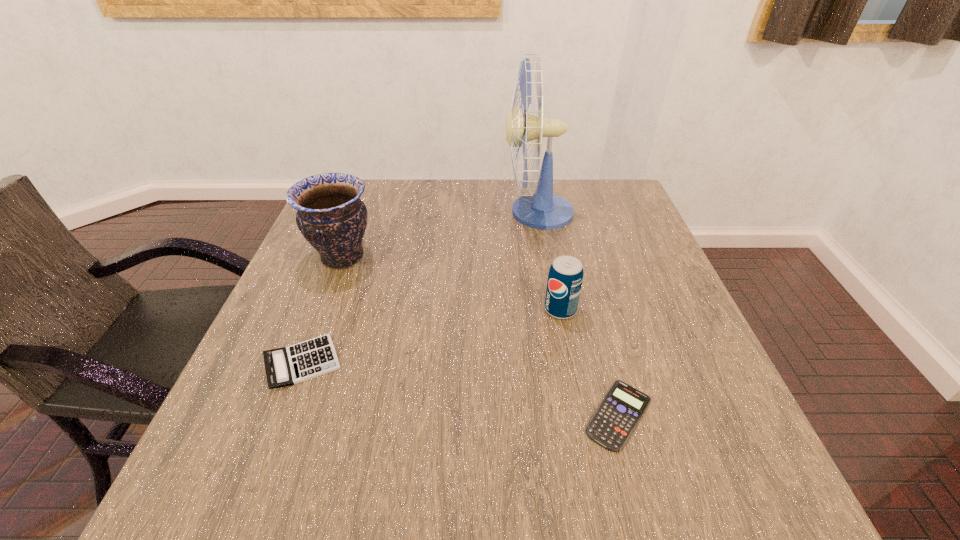
The width and height of the screenshot is (960, 540). I want to click on vacant space in between the taller calculator and the fourth shortest object, so click(x=323, y=310).

This screenshot has width=960, height=540. I want to click on unoccupied position between the fourth tallest object and the pottery, so click(323, 310).

Identify the location of unoccupied area between the taller calculator and the shortest object. The width and height of the screenshot is (960, 540). (461, 389).

This screenshot has height=540, width=960. Find the location of `free space that is in between the third tallest object and the tallest object`. free space that is in between the third tallest object and the tallest object is located at coordinates 549,261.

Point out which object is positioned as the nearest to the second shortest object. Please provide its 2D coordinates. Your answer should be formatted as a tuple, i.e. [(x, y)], where the tuple contains the x and y coordinates of a point satisfying the conditions above.

[(331, 216)]

The image size is (960, 540). What are the coordinates of `the third closest object to the right calculator` in the screenshot? It's located at (286, 366).

Locate an element on the screen. The image size is (960, 540). free space in the image that satisfies the following two spatial constraints: 1. on the back side of the right calculator; 2. at the front of the fan where the blades are visible is located at coordinates (564, 213).

Find the location of a particular element. free spot that satisfies the following two spatial constraints: 1. on the front handle of the pottery; 2. on the front side of the fourth tallest object is located at coordinates (302, 362).

What are the coordinates of `vacant space that satisfies the following two spatial constraints: 1. on the front handle of the shortest object; 2. on the left side of the pottery` in the screenshot? It's located at (283, 415).

This screenshot has width=960, height=540. Identify the location of free location that satisfies the following two spatial constraints: 1. on the front handle of the shortest object; 2. on the left side of the pottery. pos(283,415).